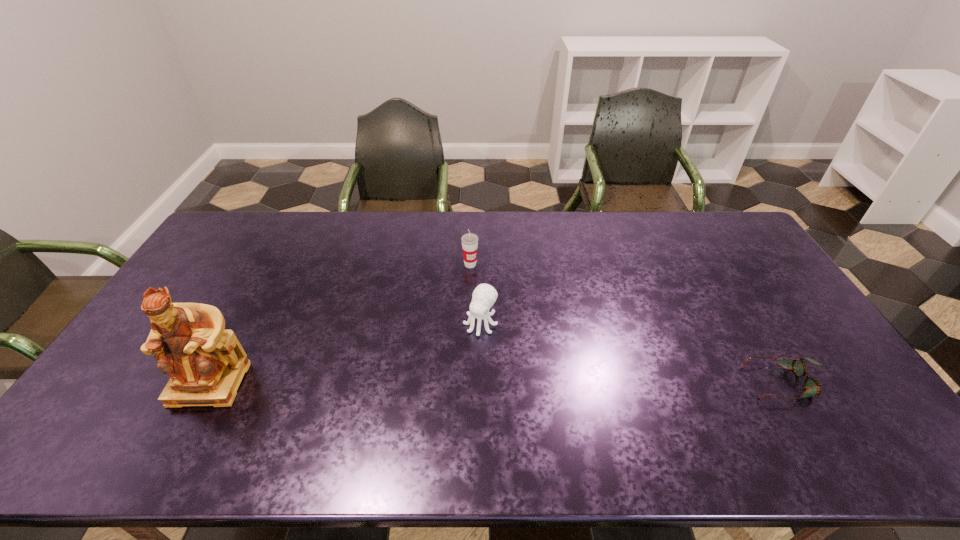
This screenshot has height=540, width=960. I want to click on the leftmost object, so click(206, 363).

The height and width of the screenshot is (540, 960). Identify the location of the tallest object. (206, 363).

Identify the location of the rightmost object. (812, 386).

The width and height of the screenshot is (960, 540). Identify the location of the shortest object. (812, 386).

Find the location of `the second farthest object`. the second farthest object is located at coordinates (484, 296).

Locate an element on the screen. the second shortest object is located at coordinates (484, 296).

The image size is (960, 540). I want to click on the farthest object, so click(469, 241).

This screenshot has width=960, height=540. Find the location of `the third shortest object`. the third shortest object is located at coordinates click(x=469, y=241).

This screenshot has height=540, width=960. Identify the location of free region located on the front-facing side of the shortest object. (711, 383).

Find the location of `vacant space located 0.090m on the front-facing side of the shortest object`. vacant space located 0.090m on the front-facing side of the shortest object is located at coordinates (715, 383).